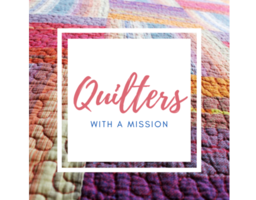
Find the location of a particular element. quilt is located at coordinates (82, 102).